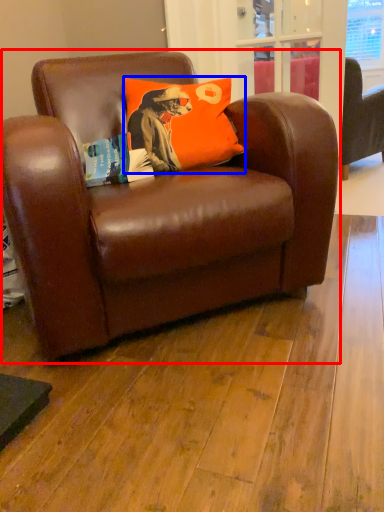
Question: Which of the following is the farthest to the observer, chair (highlighted by a red box) or pillow (highlighted by a blue box)?

Choices:
 (A) chair
 (B) pillow

Answer: (B)